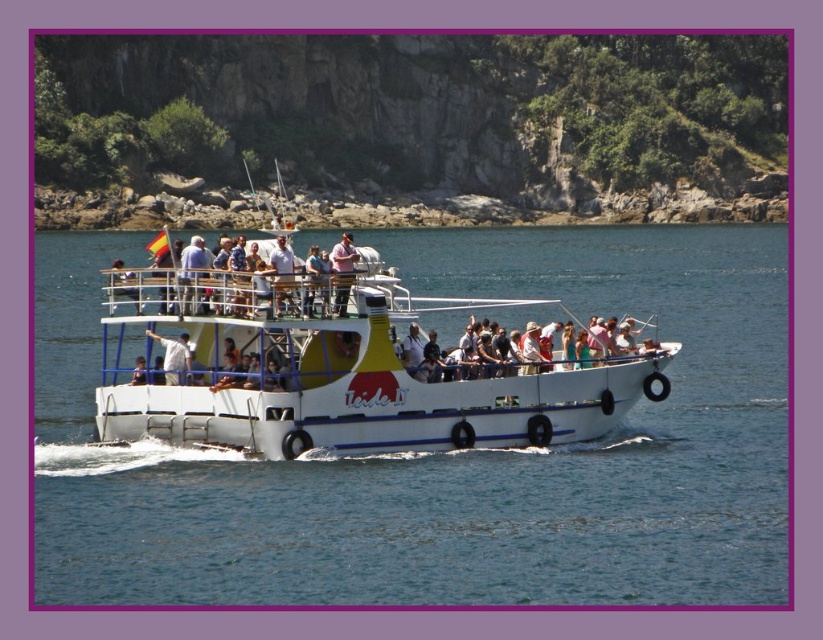
Question: Which point appears closest to the camera in this image?

Choices:
 (A) (243, 403)
 (B) (272, 586)
 (C) (335, 266)

Answer: (B)

Question: Is light brown wooden deck at center below white matte shirt at center?

Choices:
 (A) yes
 (B) no

Answer: (B)

Question: Among these objects, which one is nearest to the camera?

Choices:
 (A) blue water at center
 (B) light brown wooden deck at center
 (C) pink fabric shirt at center

Answer: (A)

Question: Is blue water at center wider than light brown wooden deck at center?

Choices:
 (A) yes
 (B) no

Answer: (A)

Question: Observing the image, what is the correct spatial positioning of blue water at center in reference to light brown wooden deck at center?

Choices:
 (A) below
 (B) above

Answer: (B)

Question: Considering the real-world distances, which object is closest to the pink fabric shirt at center?

Choices:
 (A) light brown wooden deck at center
 (B) blue water at center
 (C) white matte boat at center

Answer: (A)